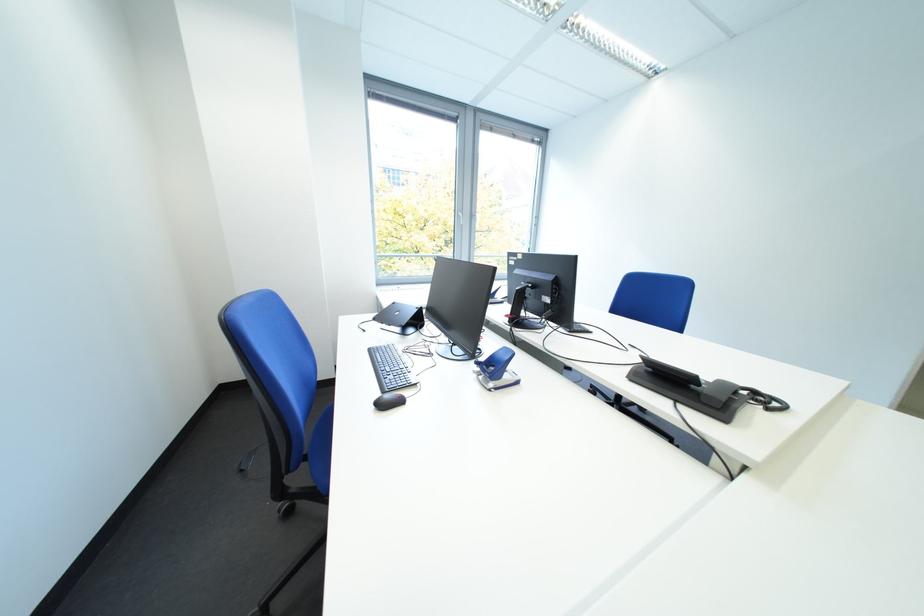
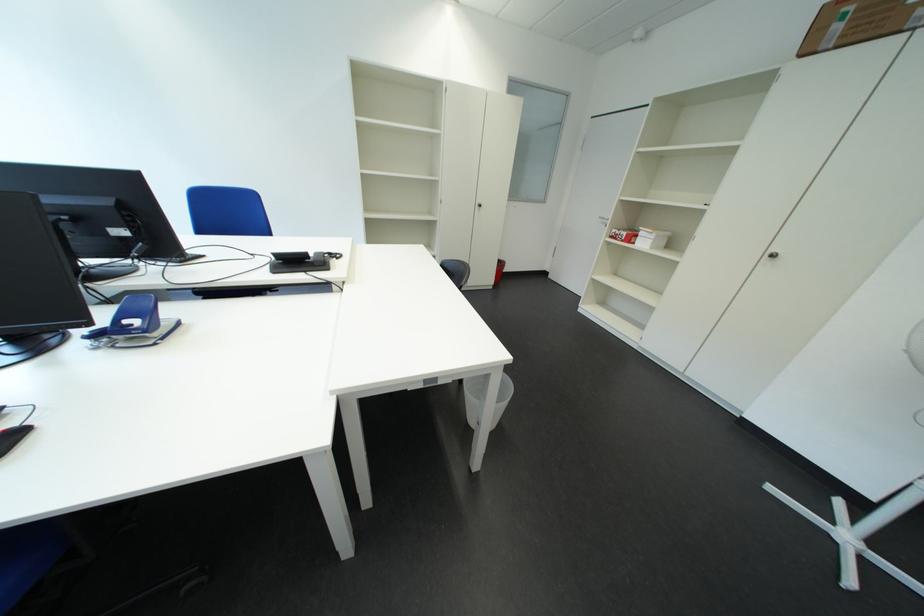
Locate, in the second image, the point that corresponds to (768,395) in the first image.

(342, 256)